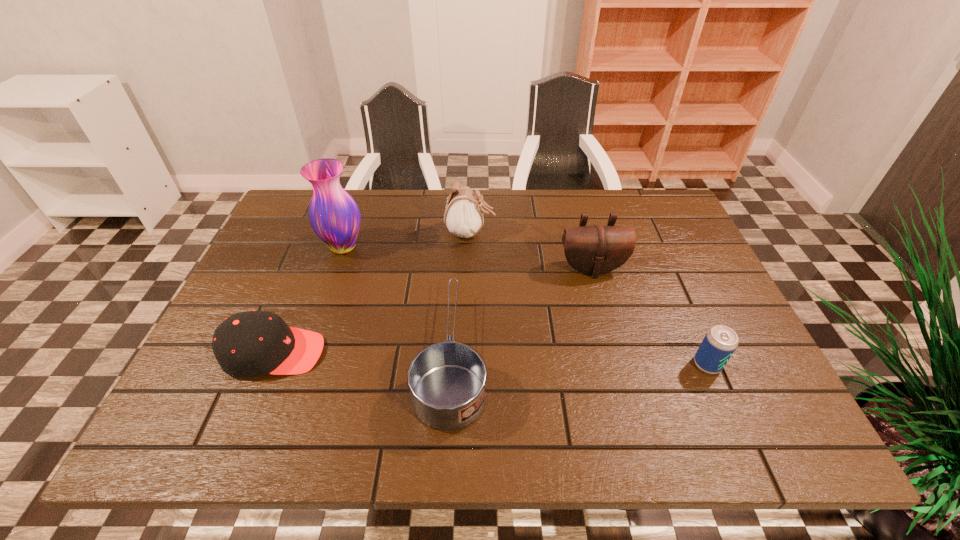
Where is `object that is at the right edge`? This screenshot has height=540, width=960. object that is at the right edge is located at coordinates (720, 342).

The image size is (960, 540). Identify the location of object located at the far left corner. (334, 216).

Where is `vacant space at the far edge of the desktop`? vacant space at the far edge of the desktop is located at coordinates (374, 221).

You are a GUI agent. You are given a task and a screenshot of the screen. Output one action in this format:
    pyautogui.click(x=<x>, y=<y>)
    Task: Click on the free region at the near edge
    This screenshot has height=540, width=960.
    Given the screenshot: What is the action you would take?
    pyautogui.click(x=619, y=414)

The height and width of the screenshot is (540, 960). In the image, there is a desktop. What are the coordinates of `vacant space at the left edge` in the screenshot? It's located at (251, 392).

Identify the location of blank space at the right edge of the desktop. The image size is (960, 540). (662, 275).

The width and height of the screenshot is (960, 540). Identify the location of vacant space at the far left corner of the desktop. (286, 211).

Locate an element on the screen. The image size is (960, 540). free space between the cap and the saucepan is located at coordinates pos(363,355).

Image resolution: width=960 pixels, height=540 pixels. Find the location of `free space that is in between the vase and the nearer pouch`. free space that is in between the vase and the nearer pouch is located at coordinates (468, 258).

Locate an element on the screen. The height and width of the screenshot is (540, 960). vacant region between the beer can and the cap is located at coordinates (491, 359).